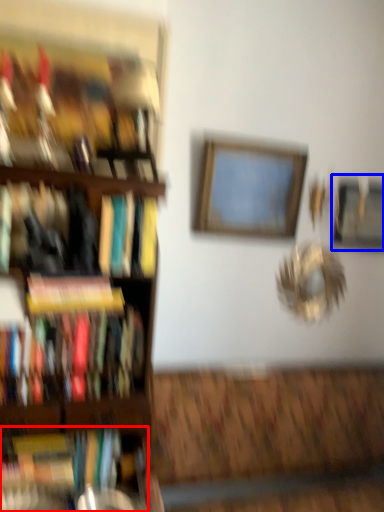
Question: Which object appears closest to the camera in this image, book (highlighted by a red box) or picture frame (highlighted by a blue box)?

Choices:
 (A) book
 (B) picture frame

Answer: (A)